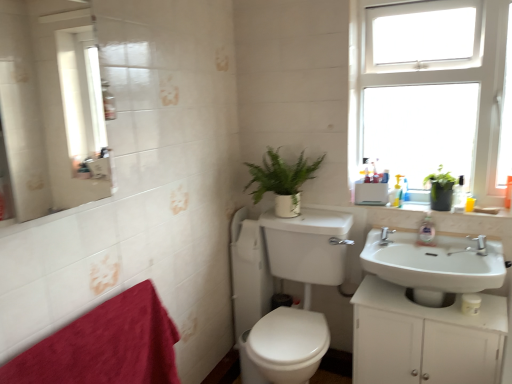
Question: Considering the positions of point (154, 349) and point (470, 301), is point (154, 349) closer or farther from the camera than point (470, 301)?

Choices:
 (A) closer
 (B) farther

Answer: (A)

Question: In the image, is velvety red bath towel at lower left on the left side or the right side of white matte toilet paper at lower center?

Choices:
 (A) left
 (B) right

Answer: (A)

Question: Which of these objects is positioned closest to the white glossy sink at upper right?

Choices:
 (A) silver metallic faucet at upper right
 (B) white glossy sink at center, which appears as the second sink when viewed from the right
 (C) white glossy sink at lower right, the second sink when ordered from left to right
 (D) yellow plastic bottle at upper right, placed as the second toiletry when sorted from back to front
 (E) white matte cabinet at lower right

Answer: (D)

Question: Estimate the real-world distances between objects in this image. Which object is farther from the translucent plastic soap dispenser at upper right, which is the second toiletry in right-to-left order?

Choices:
 (A) green matte plant at upper right
 (B) clear plastic soap dispenser at sink right
 (C) white glossy sink at upper right
 (D) white plastic window at upper right
 (E) white glossy sink at lower right, the second sink when ordered from left to right

Answer: (D)